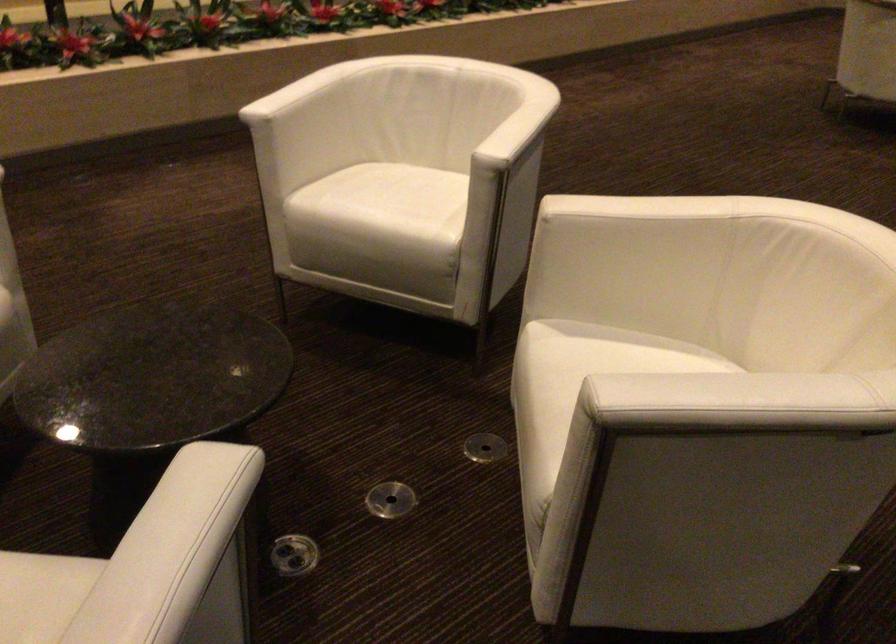
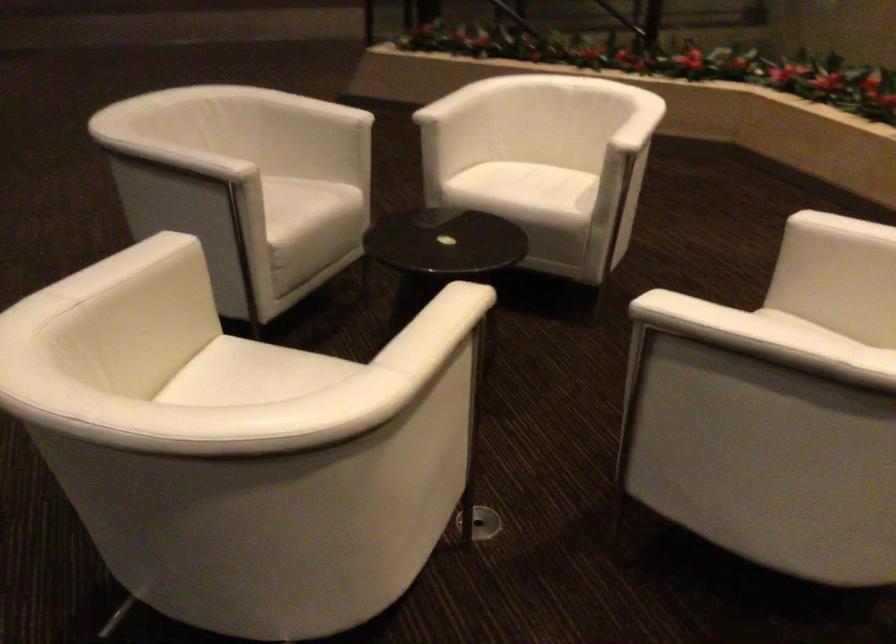
Find the pixel in the second image that matches pixel 521 137 in the first image.

(694, 317)